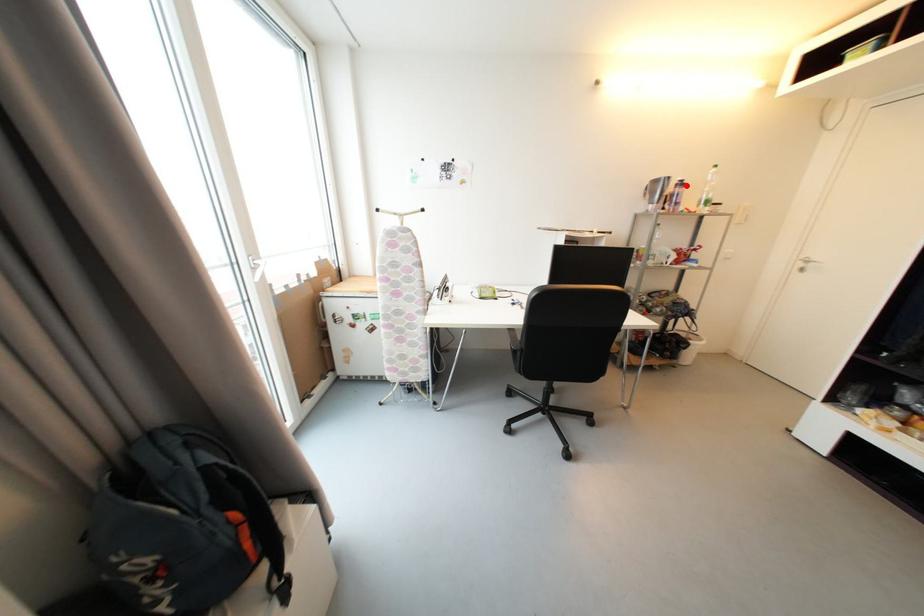
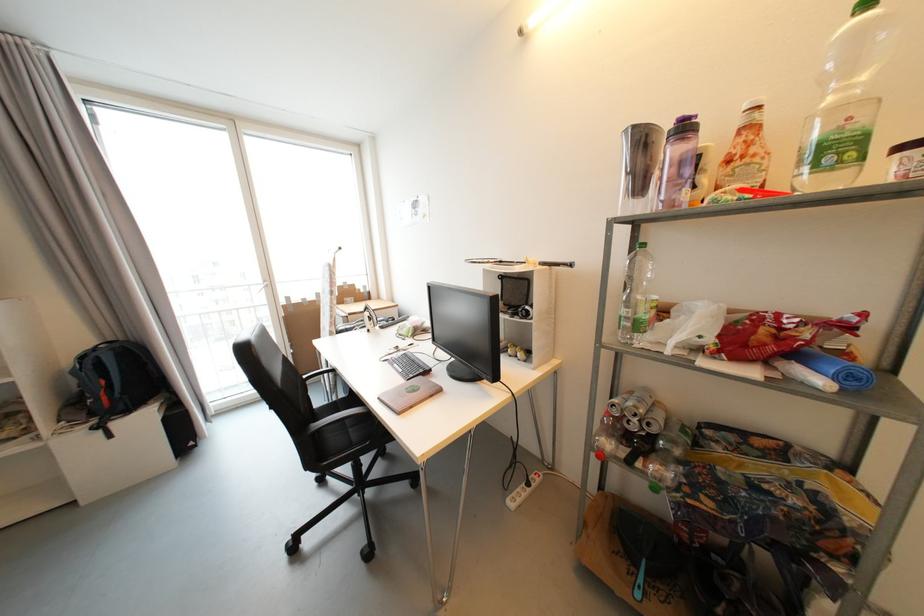
Find the pixel in the second image that matches the highlighted location in the first image.

(689, 130)